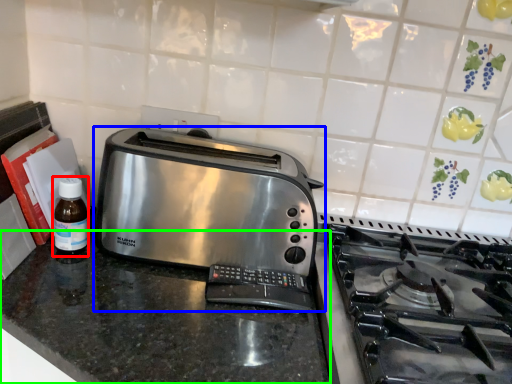
Question: Which is nearer to the bottle (highlighted by a red box)? toaster (highlighted by a blue box) or counter (highlighted by a green box).

Choices:
 (A) toaster
 (B) counter

Answer: (B)